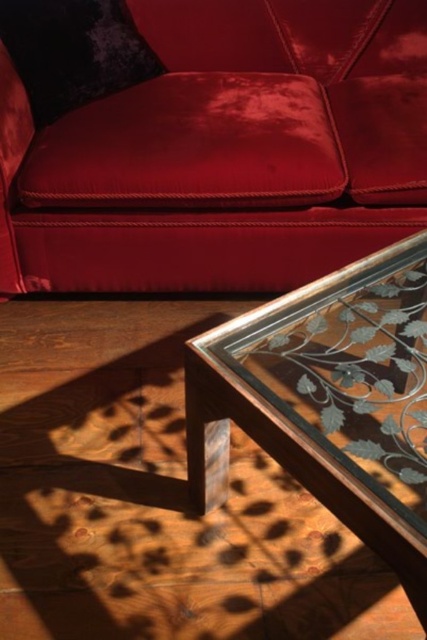
Describe the element at coordinates (224, 152) in the screenshot. I see `velvet red couch at upper center` at that location.

Image resolution: width=427 pixels, height=640 pixels. In order to click on velvet red couch at upper center in this screenshot , I will do `click(224, 152)`.